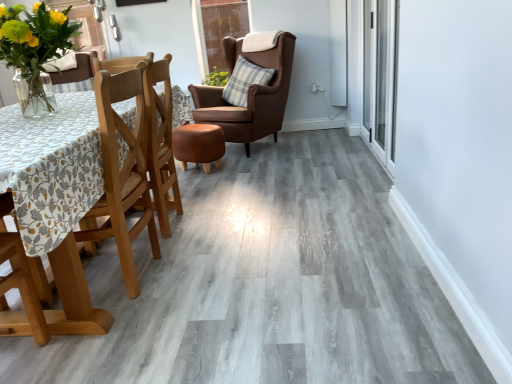
Question: Is the depth of brown leather wingback chair at center, placed as the first chair when sorted from top to bottom, greater than that of plaid fabric pillow at center, which is the 2th pillow from left to right?

Choices:
 (A) no
 (B) yes

Answer: (A)

Question: Is brown leather wingback chair at center, positioned as the 1th chair in back-to-front order, smaller than plaid fabric pillow at center, which is the 2th pillow from left to right?

Choices:
 (A) no
 (B) yes

Answer: (A)

Question: Is brown leather wingback chair at center, which is counted as the 2th chair, starting from the front, directly adjacent to plaid fabric pillow at center, marked as the 1th pillow in a right-to-left arrangement?

Choices:
 (A) yes
 (B) no

Answer: (B)

Question: Is brown leather wingback chair at center, which is counted as the 2th chair, starting from the front, at the left side of plaid fabric pillow at center, which is the 2th pillow from left to right?

Choices:
 (A) no
 (B) yes

Answer: (B)

Question: Can you confirm if brown leather wingback chair at center, positioned as the 1th chair in back-to-front order, is wider than plaid fabric pillow at center, which is the 2th pillow from left to right?

Choices:
 (A) yes
 (B) no

Answer: (A)

Question: Is wooden chair at left, which is the 2th chair in top-to-bottom order, wider or thinner than transparent glass door at upper center, arranged as the 2th glass door when viewed from the right?

Choices:
 (A) wide
 (B) thin

Answer: (A)

Question: Considering the positions of point (153, 233) and point (202, 16), is point (153, 233) closer or farther from the camera than point (202, 16)?

Choices:
 (A) farther
 (B) closer

Answer: (B)

Question: Which is correct: wooden chair at left, arranged as the 1th chair when ordered from the bottom, is inside transparent glass door at upper center, the second glass door in the front-to-back sequence, or outside of it?

Choices:
 (A) inside
 (B) outside

Answer: (B)

Question: From the image's perspective, relative to transparent glass door at upper center, the first glass door from the back, is wooden chair at left, acting as the first chair starting from the front, above or below?

Choices:
 (A) below
 (B) above

Answer: (A)

Question: In terms of height, does brown leather wingback chair at center, placed as the first chair when sorted from top to bottom, look taller or shorter compared to wooden chair at left, which is the 2th chair in top-to-bottom order?

Choices:
 (A) tall
 (B) short

Answer: (A)

Question: Considering the positions of point (241, 120) and point (69, 253), is point (241, 120) closer or farther from the camera than point (69, 253)?

Choices:
 (A) farther
 (B) closer

Answer: (A)

Question: From a real-world perspective, is brown leather wingback chair at center, placed as the second chair when sorted from bottom to top, physically located above or below wooden chair at left, acting as the first chair starting from the front?

Choices:
 (A) below
 (B) above

Answer: (B)

Question: Choose the correct answer: Is brown leather wingback chair at center, positioned as the 1th chair in back-to-front order, inside wooden chair at left, arranged as the second chair when viewed from the back, or outside it?

Choices:
 (A) outside
 (B) inside

Answer: (A)

Question: Is point (224, 69) closer or farther from the camera than point (234, 64)?

Choices:
 (A) farther
 (B) closer

Answer: (A)

Question: Is transparent glass door at upper center, the second glass door in the front-to-back sequence, to the left or to the right of plaid fabric pillow at center, marked as the 1th pillow in a right-to-left arrangement, in the image?

Choices:
 (A) right
 (B) left

Answer: (B)